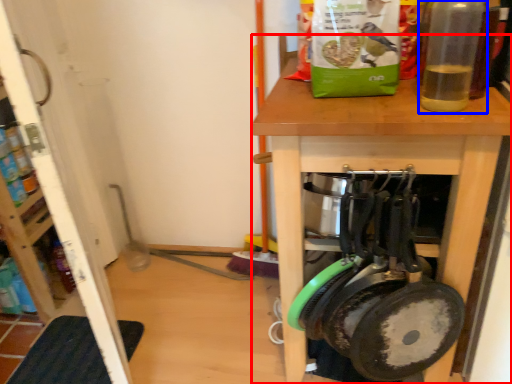
Question: Which object is further to the camera taking this photo, desk (highlighted by a red box) or bottle (highlighted by a blue box)?

Choices:
 (A) desk
 (B) bottle

Answer: (A)